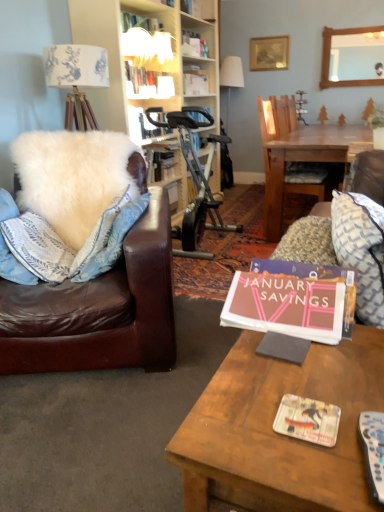
The image size is (384, 512). What are the coordinates of `vacant space in front of matte paper magazine at center` in the screenshot? It's located at (321, 466).